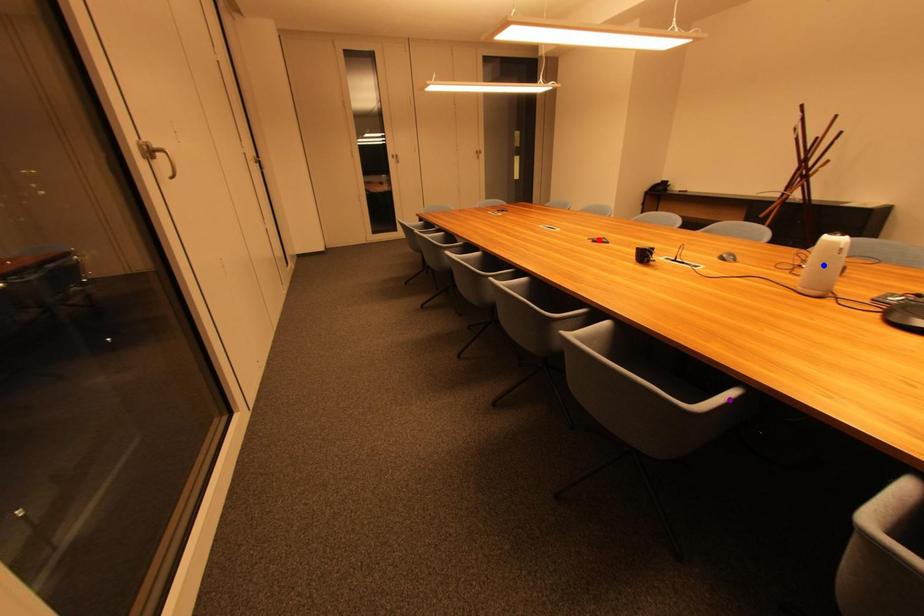
Order these from nearest to farthest:
1. red point
2. purple point
3. blue point

purple point → blue point → red point